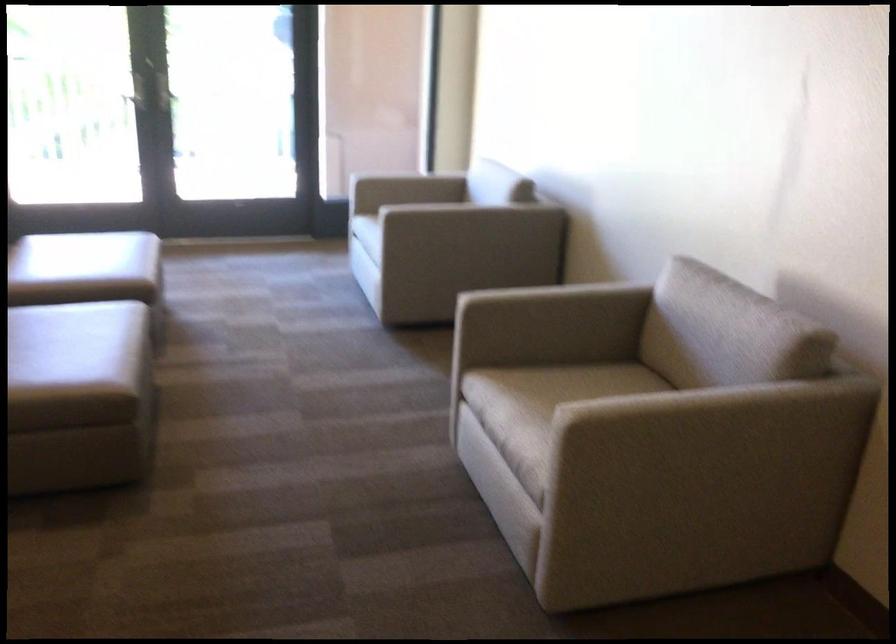
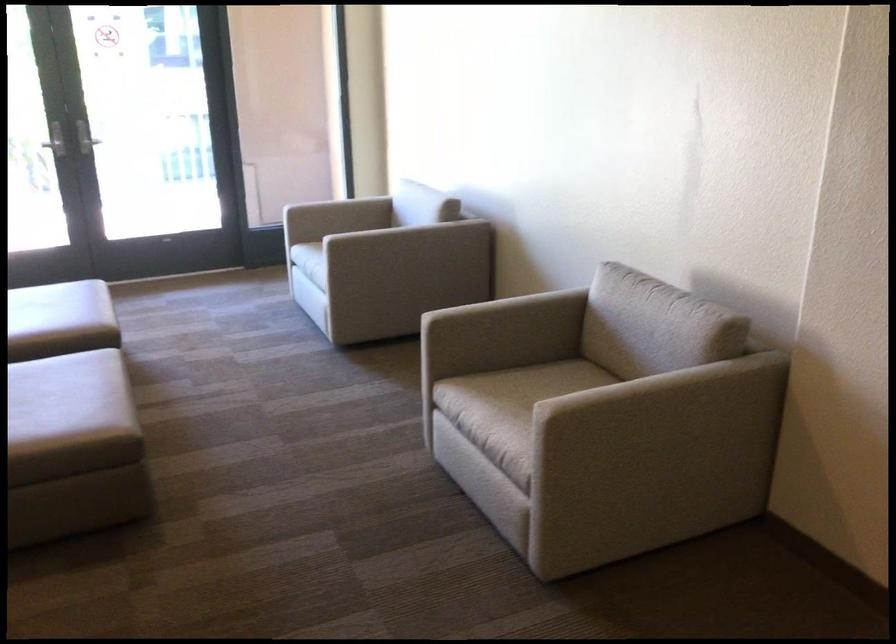
Find the pixel in the second image that matches [446,176] in the first image.

(375, 200)